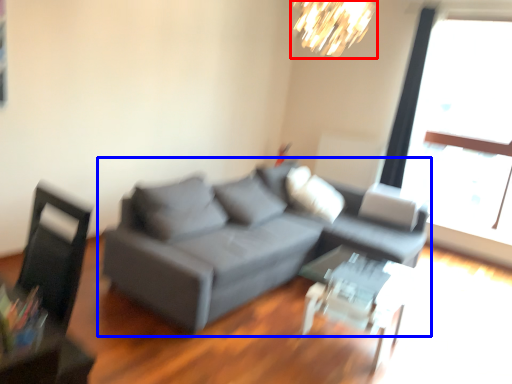
Question: Which object is further to the camera taking this photo, lamp (highlighted by a red box) or studio couch (highlighted by a blue box)?

Choices:
 (A) lamp
 (B) studio couch

Answer: (A)